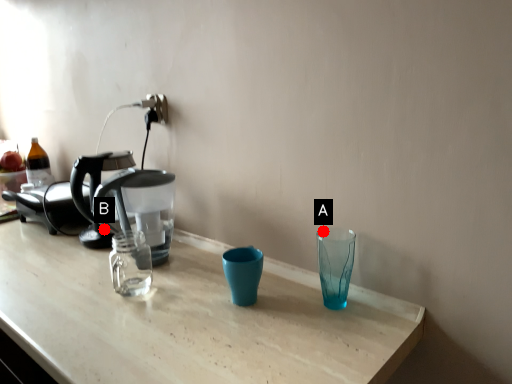
Question: Two points are circled on the image, labeled by A and B beside each circle. Which point is farther to the camera?

Choices:
 (A) A is further
 (B) B is further

Answer: (B)